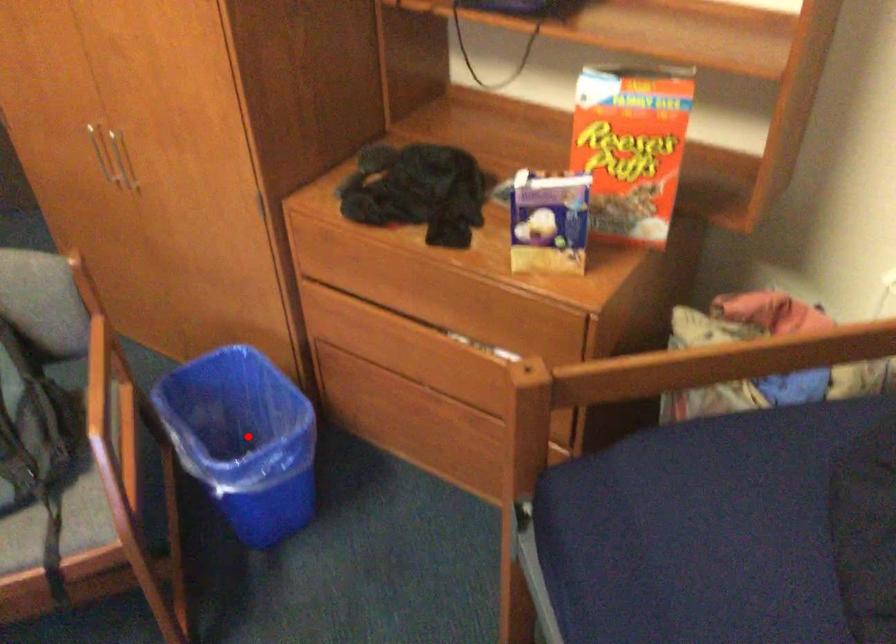
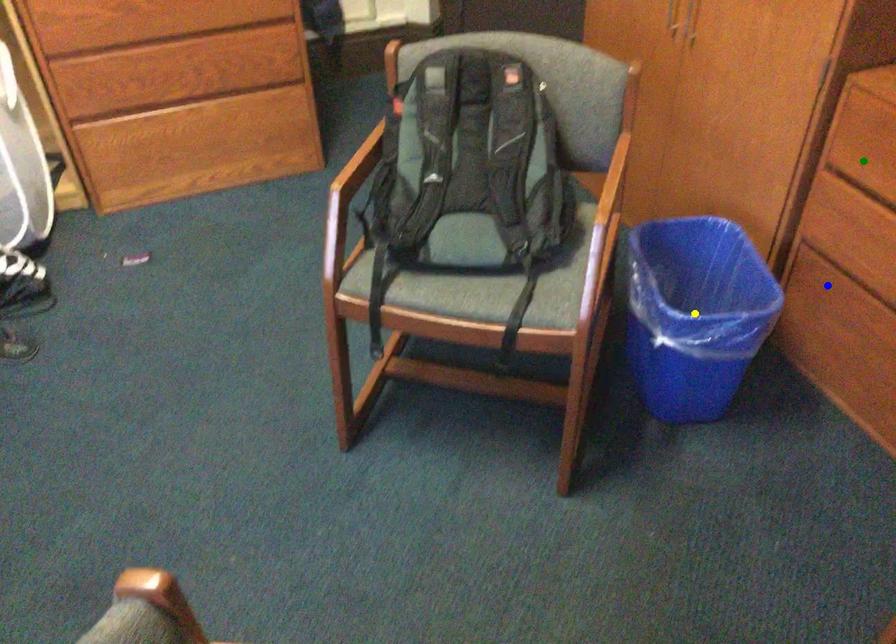
Question: I am providing you with two images of the same scene from different viewpoints. A red point is marked on the first image. You are given multiple points on the second image. Which point in image 2 is actually the same real-world point as the red point in image 1?

Choices:
 (A) blue point
 (B) green point
 (C) yellow point

Answer: (C)